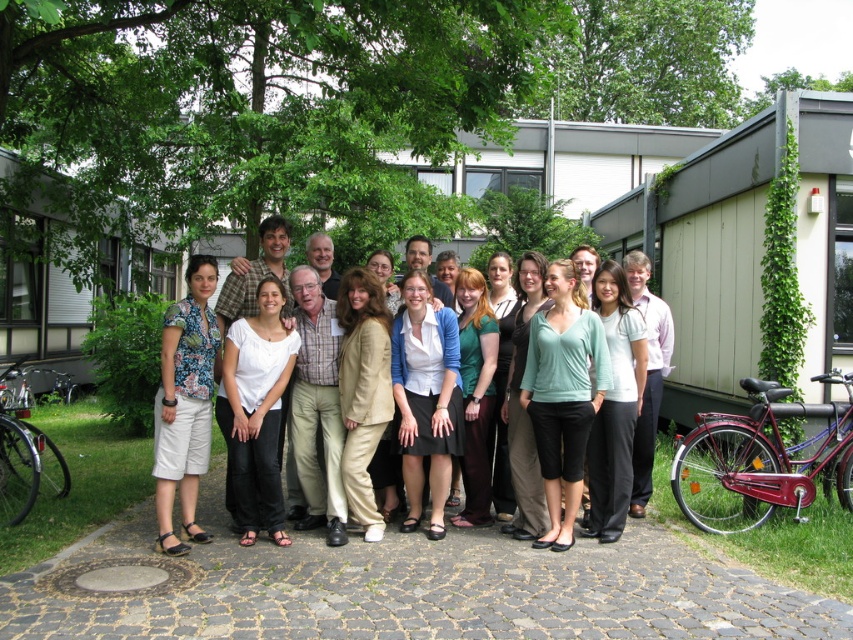
From the picture: Who is more distant from viewer, (171,381) or (178,470)?

The point (178,470) is behind.

Is point (222, 282) behind point (192, 474)?

Yes, point (222, 282) is behind point (192, 474).

What do you see at coordinates (236, 301) in the screenshot? I see `light beige suit at center` at bounding box center [236, 301].

You are a GUI agent. You are given a task and a screenshot of the screen. Output one action in this format:
    pyautogui.click(x=<x>, y=<y>)
    Task: Click on the light beige suit at center
    
    Given the screenshot: What is the action you would take?
    pyautogui.click(x=236, y=301)